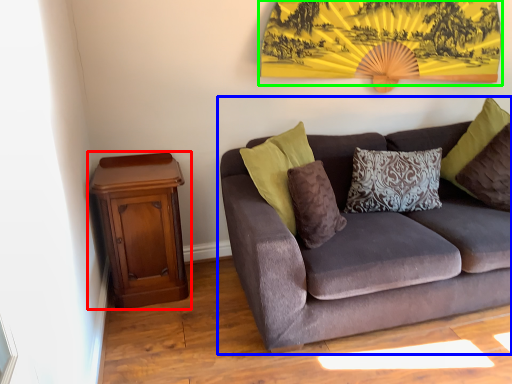
Question: Which object is positioned farthest from nightstand (highlighted by a red box)? Select from studio couch (highlighted by a blue box) and mountain view (highlighted by a green box).

Choices:
 (A) studio couch
 (B) mountain view

Answer: (B)